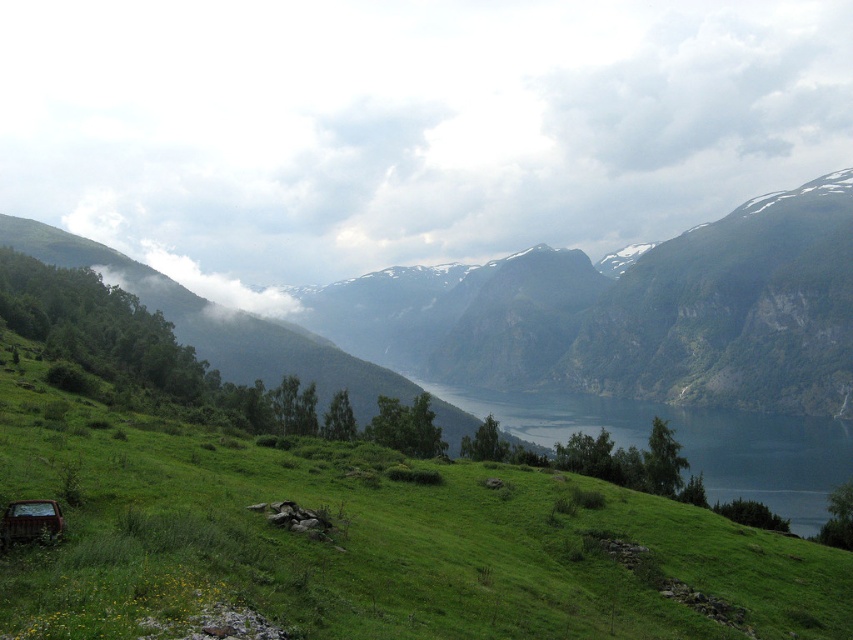
Is white fluffy cloud at upper center thinner than green grassy hillside at lower left?

→ In fact, white fluffy cloud at upper center might be wider than green grassy hillside at lower left.

Does white fluffy cloud at upper center have a greater width compared to green grassy hillside at lower left?

Correct, the width of white fluffy cloud at upper center exceeds that of green grassy hillside at lower left.

Image resolution: width=853 pixels, height=640 pixels. What are the coordinates of `white fluffy cloud at upper center` in the screenshot? It's located at (405, 125).

Can you confirm if green grassy hillside at lower left is positioned above white fluffy cloud at upper right?

No.

Does green grassy hillside at lower left appear under white fluffy cloud at upper right?

Correct, green grassy hillside at lower left is located below white fluffy cloud at upper right.

The height and width of the screenshot is (640, 853). In order to click on green grassy hillside at lower left in this screenshot , I will do `click(363, 540)`.

Find the location of a particular element. The width and height of the screenshot is (853, 640). green grassy hillside at lower left is located at coordinates (363, 540).

Is point (531, 230) behind point (711, 99)?

That is False.

Is point (793, 60) farther from camera compared to point (750, 176)?

Yes, point (793, 60) is farther from viewer.

Find the location of a particular element. This screenshot has height=640, width=853. white fluffy cloud at upper center is located at coordinates (405, 125).